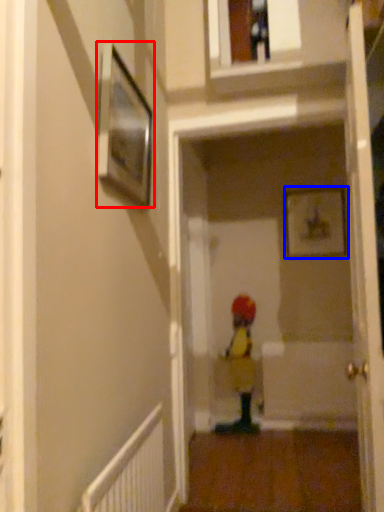
Question: Among these objects, which one is nearest to the camera, picture frame (highlighted by a red box) or picture frame (highlighted by a blue box)?

Choices:
 (A) picture frame
 (B) picture frame

Answer: (A)